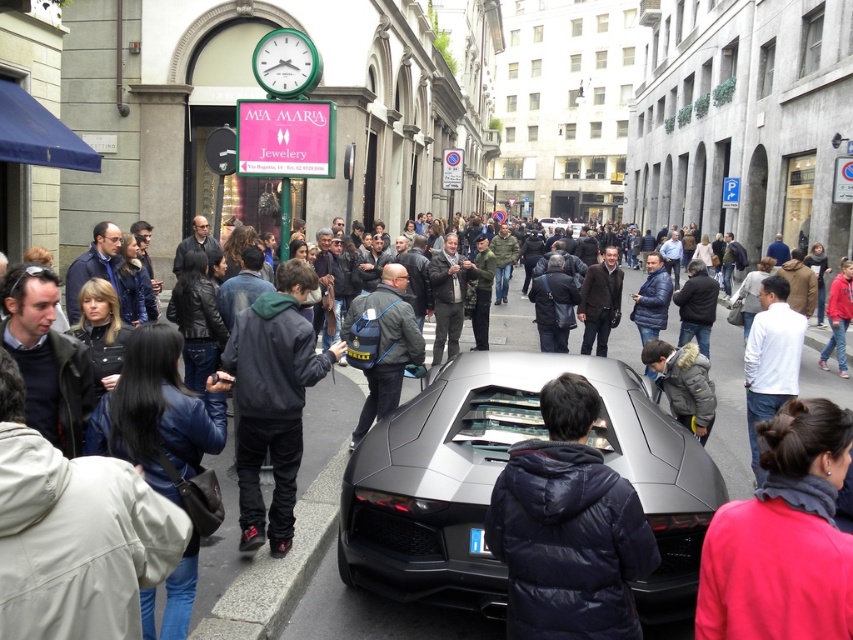
Describe the element at coordinates (160, 412) in the screenshot. The width and height of the screenshot is (853, 640). I see `dark blue leather jacket at center` at that location.

Who is taller, dark blue leather jacket at center or dark gray backpack at center?

Standing taller between the two is dark gray backpack at center.

Between point (218, 428) and point (393, 275), which one is positioned in front?

Point (218, 428) is more forward.

Locate an element on the screen. The image size is (853, 640). dark blue leather jacket at center is located at coordinates (160, 412).

The height and width of the screenshot is (640, 853). What do you see at coordinates (497, 474) in the screenshot?
I see `matt metallic sports car at center` at bounding box center [497, 474].

This screenshot has width=853, height=640. What are the coordinates of `matt metallic sports car at center` in the screenshot? It's located at (497, 474).

Is point (369, 461) positioned in front of point (517, 576)?

No, it is not.

At what (x,y) coordinates should I click in order to perform the action: click on matt metallic sports car at center. Please return your answer as a coordinate pair (x, y). Looking at the image, I should click on (497, 474).

From the picture: Does matte black jacket at center have a greater width compared to red fleece jacket at center?

Yes.

Does matte black jacket at center come in front of red fleece jacket at center?

That is False.

Does point (851, 380) come in front of point (706, 602)?

That is False.

Where is `matte black jacket at center`? The height and width of the screenshot is (640, 853). matte black jacket at center is located at coordinates (372, 614).